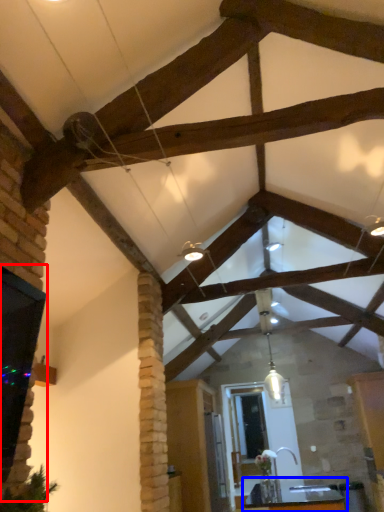
Question: Which of the following is the farthest to the observer, window (highlighted by a red box) or table (highlighted by a blue box)?

Choices:
 (A) window
 (B) table

Answer: (B)